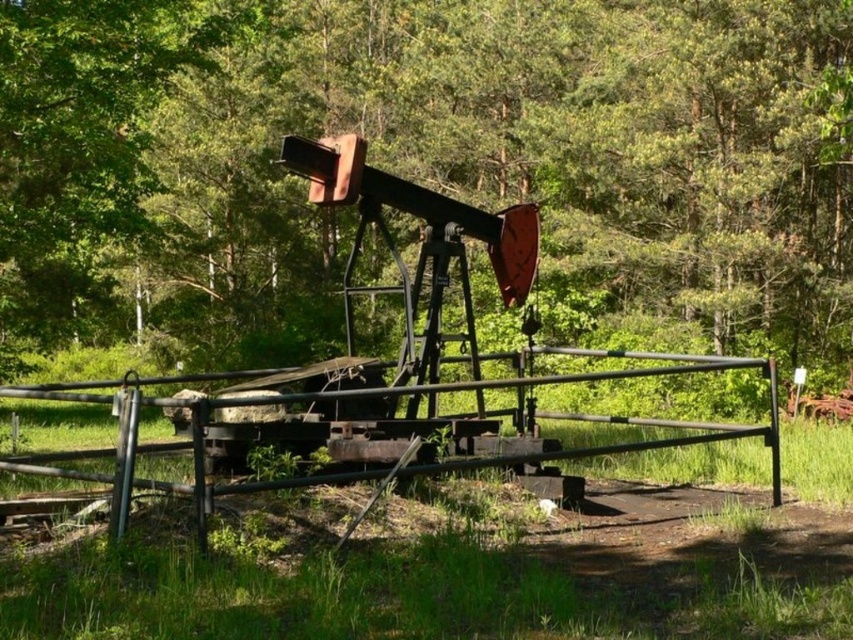
How distant is green leafy tree at center from rusty metal fence at center?

A distance of 20.16 meters exists between green leafy tree at center and rusty metal fence at center.

Is green leafy tree at center to the left of rusty metal fence at center from the viewer's perspective?

Yes, green leafy tree at center is to the left of rusty metal fence at center.

At what (x,y) coordinates should I click in order to perform the action: click on green leafy tree at center. Please return your answer as a coordinate pair (x, y). The image size is (853, 640). Looking at the image, I should click on (485, 161).

Identify the location of green leafy tree at center. (485, 161).